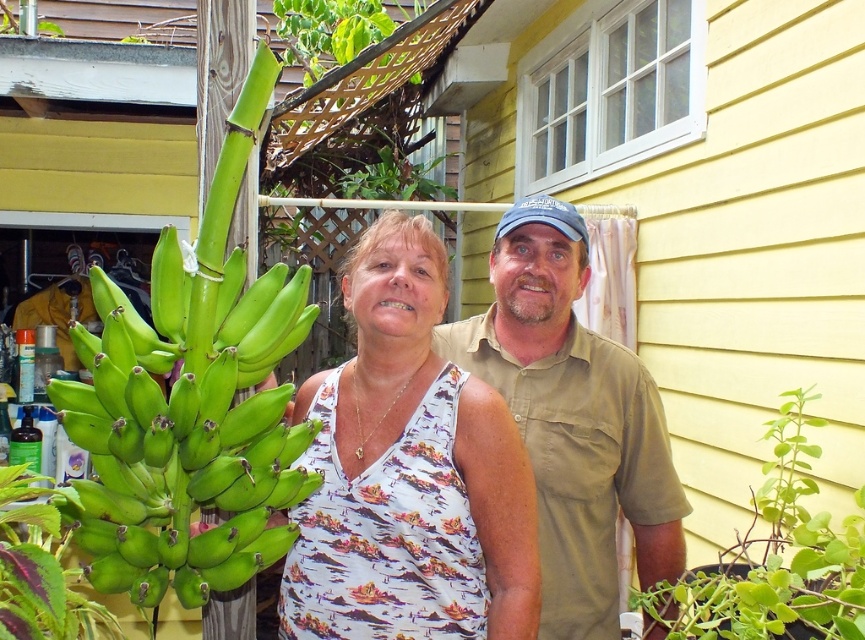
Question: Is white floral tank top at center thinner than khaki cotton shirt at center?

Choices:
 (A) yes
 (B) no

Answer: (A)

Question: Which is farther from the white floral tank top at center?

Choices:
 (A) khaki cotton shirt at center
 (B) green matte bananas at left

Answer: (A)

Question: Among these points, which one is nearest to the camera?

Choices:
 (A) (238, 586)
 (B) (682, 506)

Answer: (A)

Question: Does green matte bananas at left have a lesser width compared to khaki cotton shirt at center?

Choices:
 (A) yes
 (B) no

Answer: (A)

Question: Does white floral tank top at center appear on the right side of green matte bananas at left?

Choices:
 (A) yes
 (B) no

Answer: (A)

Question: Among these objects, which one is farthest from the camera?

Choices:
 (A) white floral tank top at center
 (B) khaki cotton shirt at center
 (C) green matte bananas at left

Answer: (B)